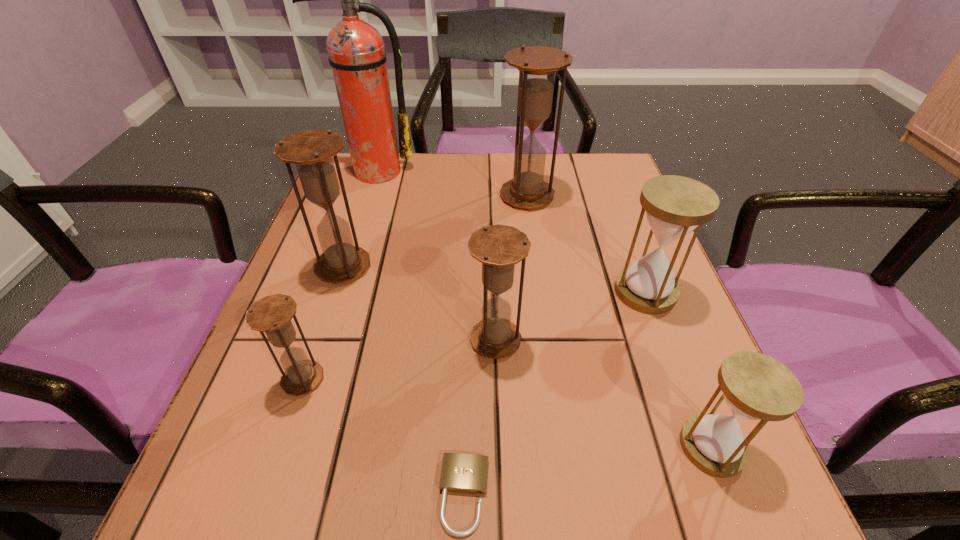
Where is `vacant position in the image that satisfies the following two spatial constraints: 1. on the front side of the farther white hourglass; 2. on the right side of the second biggest brown hourglass`? The width and height of the screenshot is (960, 540). vacant position in the image that satisfies the following two spatial constraints: 1. on the front side of the farther white hourglass; 2. on the right side of the second biggest brown hourglass is located at coordinates (335, 292).